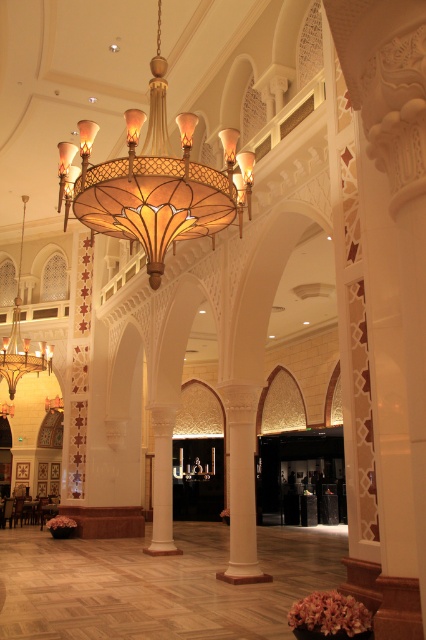
Question: Is matte glass chandelier at center closer to camera compared to matte gold chandelier at upper center?

Choices:
 (A) yes
 (B) no

Answer: (A)

Question: Does matte glass chandelier at center have a larger size compared to matte gold chandelier at upper center?

Choices:
 (A) yes
 (B) no

Answer: (A)

Question: Can you confirm if matte glass chandelier at center is positioned to the left of matte gold chandelier at upper center?

Choices:
 (A) yes
 (B) no

Answer: (B)

Question: Which object is farther from the camera taking this photo?

Choices:
 (A) matte glass chandelier at center
 (B) matte gold chandelier at upper center

Answer: (B)